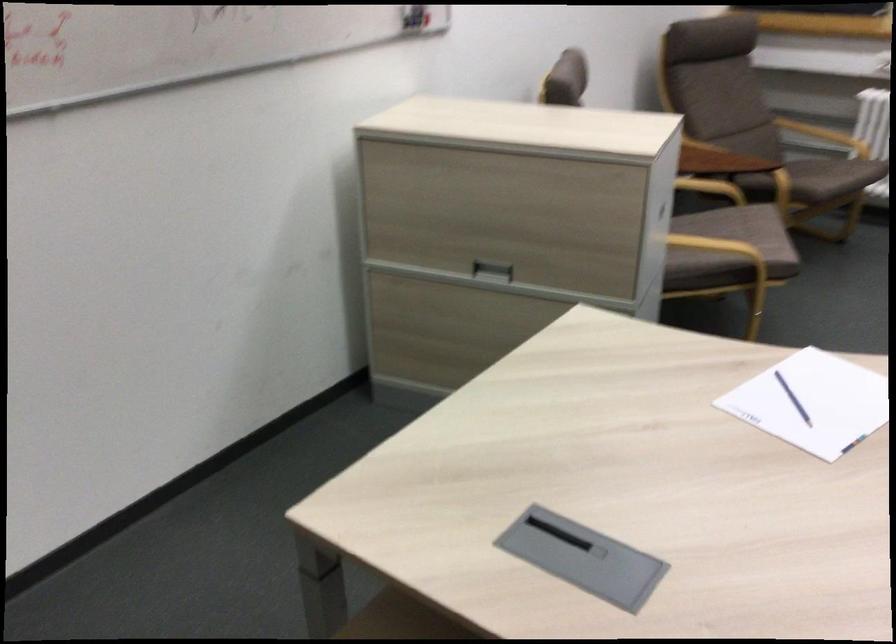
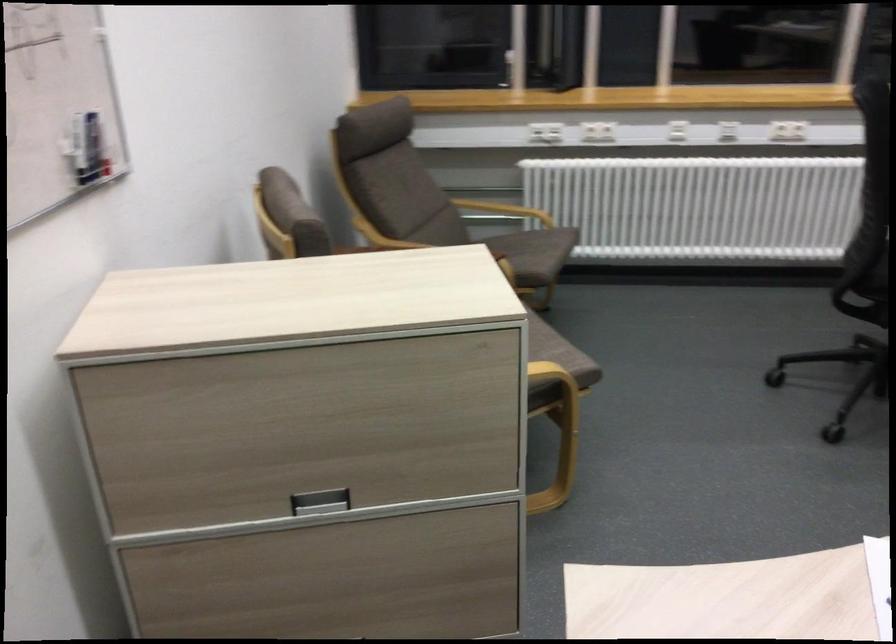
Question: The camera is either moving clockwise (left) or counter-clockwise (right) around the object. The first image is from the beginning of the video and the second image is from the end. Is the camera moving left or right when shooting the video?

Choices:
 (A) Left
 (B) Right

Answer: (A)